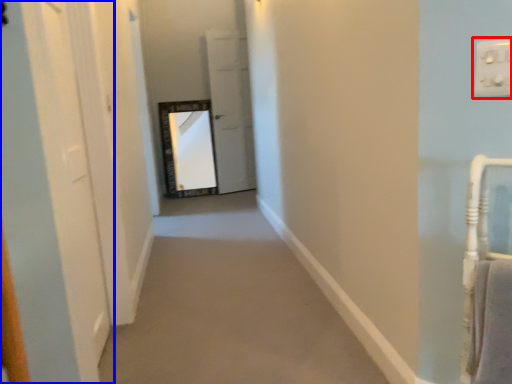
Question: Which of the following is the farthest to the observer, electric outlet (highlighted by a red box) or door (highlighted by a blue box)?

Choices:
 (A) electric outlet
 (B) door

Answer: (B)